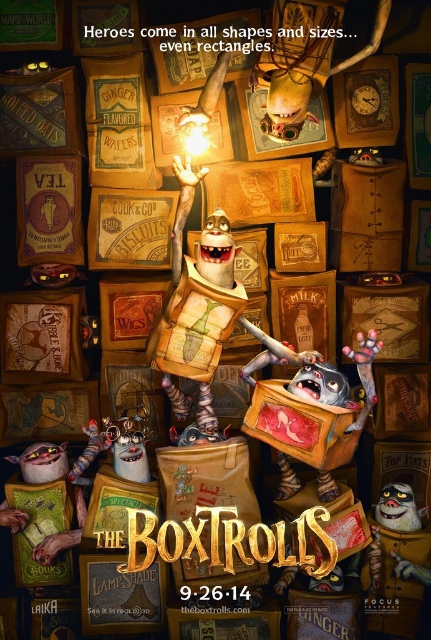
Question: Which point is closer to the camera?

Choices:
 (A) (287, 481)
 (B) (422, 538)
 (C) (224, 278)
 (D) (75, 529)

Answer: (B)

Question: Which of the following is the closest to the observer?

Choices:
 (A) coord(203,330)
 (B) coord(368,394)
 (C) coord(400,616)

Answer: (B)

Question: Is wooden book at center to the left of shiny metallic toy at bottom right from the viewer's perspective?

Choices:
 (A) no
 (B) yes

Answer: (B)

Question: Which point appears closest to the camera in this image?

Choices:
 (A) (427, 544)
 (B) (233, 241)

Answer: (B)

Question: Is shiny metallic toy at bottom right to the left of fluffy white pillow at lower left from the viewer's perspective?

Choices:
 (A) no
 (B) yes

Answer: (A)

Question: Does wooden book at center have a lesser width compared to shiny metallic toy at bottom right?

Choices:
 (A) yes
 (B) no

Answer: (B)